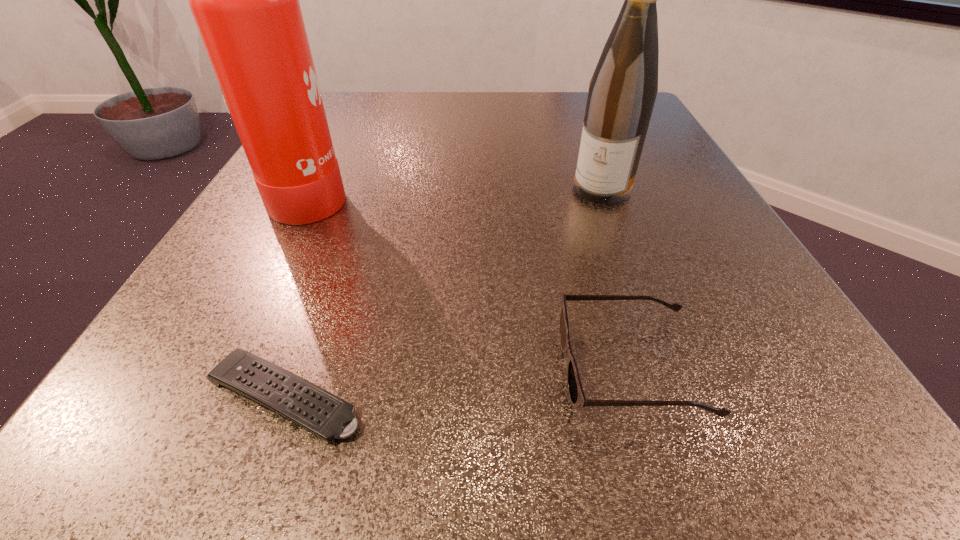
In the image, there is a desktop. At what (x,y) coordinates should I click in order to perform the action: click on vacant space at the left edge. Please return your answer as a coordinate pair (x, y). This screenshot has height=540, width=960. Looking at the image, I should click on (228, 350).

Locate an element on the screen. The width and height of the screenshot is (960, 540). free space at the right edge of the desktop is located at coordinates (759, 276).

At what (x,y) coordinates should I click in order to perform the action: click on vacant space at the far left corner of the desktop. Please return your answer as a coordinate pair (x, y). Looking at the image, I should click on (372, 132).

Locate an element on the screen. blank space at the near right corner of the desktop is located at coordinates (717, 428).

Locate an element on the screen. This screenshot has height=540, width=960. vacant area that lies between the wine bottle and the third tallest object is located at coordinates (616, 278).

Identify the location of vacant space that is in between the fire extinguisher and the sunglasses. The width and height of the screenshot is (960, 540). pos(471,280).

Image resolution: width=960 pixels, height=540 pixels. Identify the location of vacant space that's between the second shortest object and the wine bottle. (616, 278).

Where is `vacant region between the fire extinguisher and the remote control`? vacant region between the fire extinguisher and the remote control is located at coordinates (299, 294).

Where is `blank region between the remote control and the fire extinguisher`? The image size is (960, 540). blank region between the remote control and the fire extinguisher is located at coordinates coord(299,294).

The height and width of the screenshot is (540, 960). Find the location of `empty space that is in between the fire extinguisher and the remote control`. empty space that is in between the fire extinguisher and the remote control is located at coordinates (299, 294).